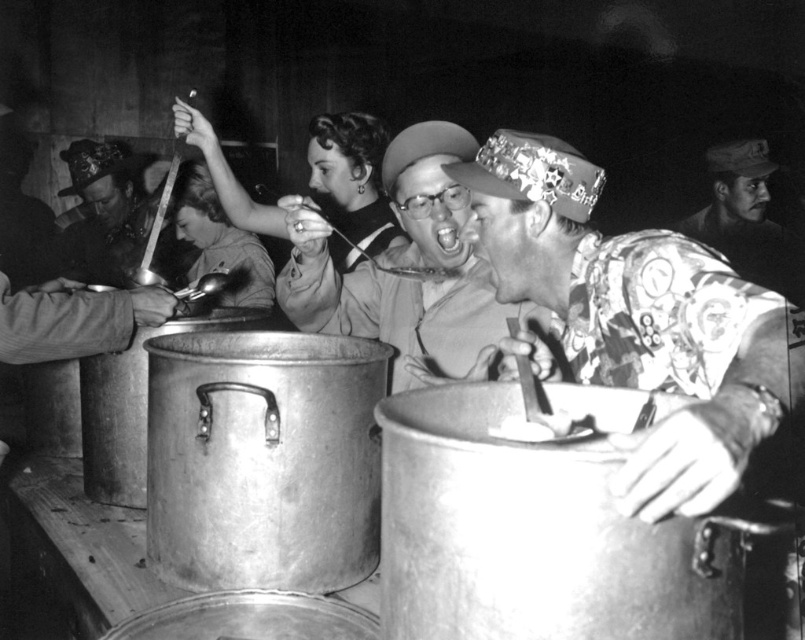
Which is behind, point (496, 333) or point (323, 150)?

Positioned behind is point (323, 150).

Can you confirm if metallic silver spoon at center is positioned to the left of smooth black hair at upper center?

No, metallic silver spoon at center is not to the left of smooth black hair at upper center.

Measure the distance between point (397, 296) and camera.

Point (397, 296) is 6.57 feet away from camera.

At what (x,y) coordinates should I click in order to perform the action: click on metallic silver spoon at center. Please return your answer as a coordinate pair (x, y). This screenshot has width=805, height=640. Looking at the image, I should click on [405, 268].

Can you confirm if metallic silver spoon at center is thinner than camouflage-patterned shirt at center?

Incorrect, metallic silver spoon at center's width is not less than camouflage-patterned shirt at center's.

Does point (328, 257) come in front of point (712, 224)?

That is True.

In order to click on metallic silver spoon at center in this screenshot , I will do `click(405, 268)`.

Who is more forward, (100, 224) or (182, 211)?

Point (182, 211)

Is point (73, 273) farther from viewer compared to point (273, 285)?

Yes, it is.

What do you see at coordinates (105, 216) in the screenshot? Image resolution: width=805 pixels, height=640 pixels. I see `shiny silver spoon at left` at bounding box center [105, 216].

Where is `shiny silver spoon at left`? shiny silver spoon at left is located at coordinates (105, 216).